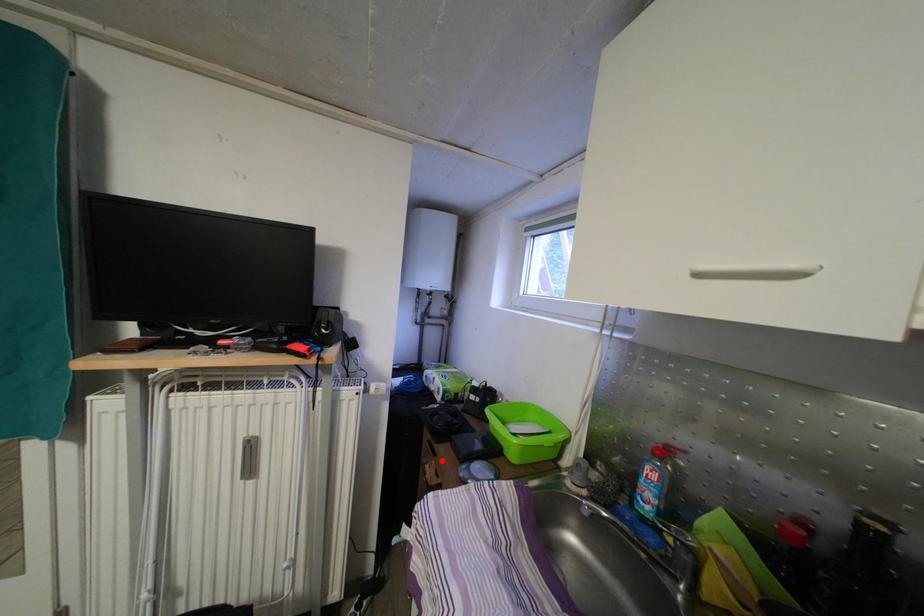
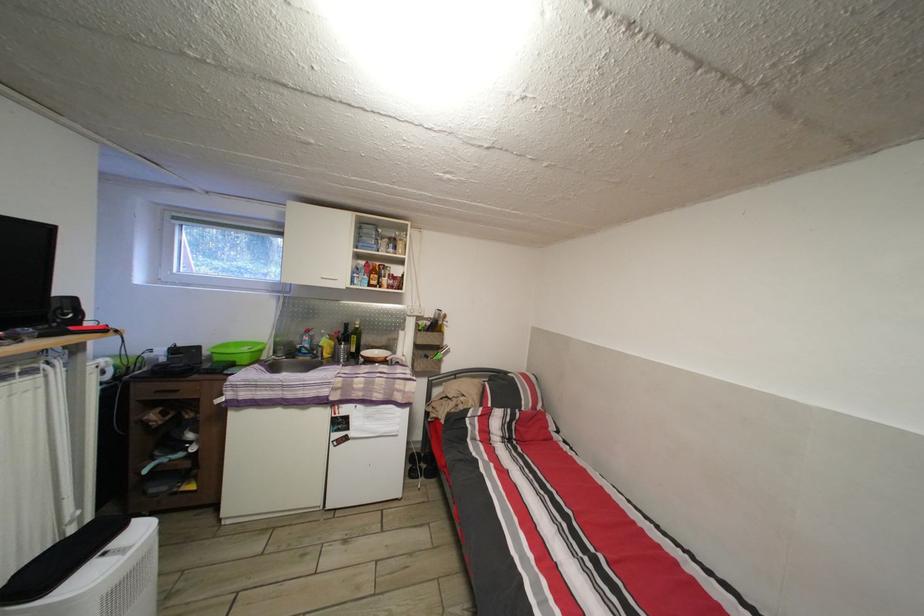
Question: A red point is marked in image1. In image2, is the corresponding 3D point closer to the camera or farther? Reply with the corresponding letter.

Choices:
 (A) The corresponding 3D point is closer.
 (B) The corresponding 3D point is farther.

Answer: (A)